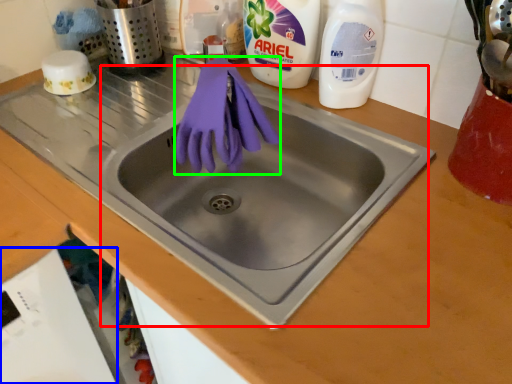
Question: Estimate the real-world distances between objects in this image. Which object is farther from sink (highlighted by a red box), dish washer (highlighted by a blue box) or glove (highlighted by a green box)?

Choices:
 (A) dish washer
 (B) glove

Answer: (A)